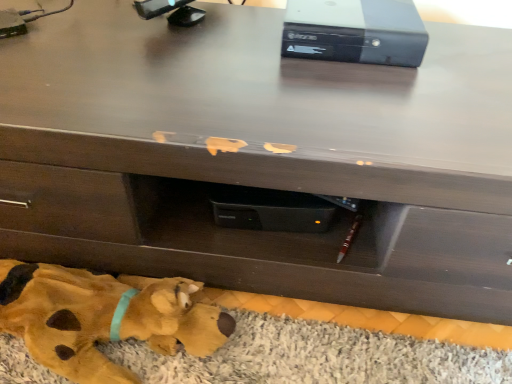
The image size is (512, 384). Identify the location of free space to the right of black plastic computer at upper center. (466, 53).